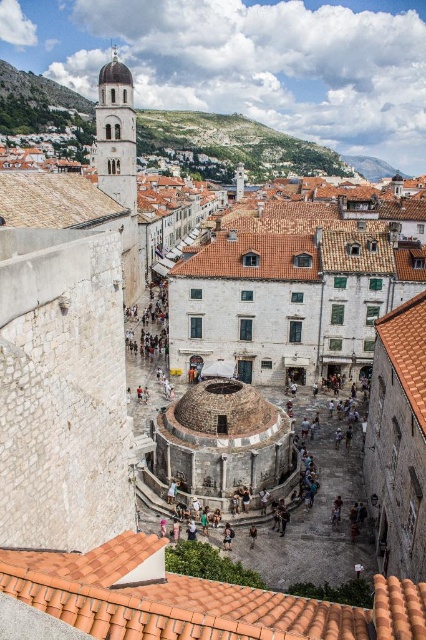
Looking at this image, can you confirm if dark brown leather backpack at center is shorter than brown leather jacket at center?

No.

From the picture: Is dark brown leather backpack at center positioned at the back of brown leather jacket at center?

No.

At what (x,y) coordinates should I click in order to perform the action: click on dark brown leather backpack at center. Please return your answer as a coordinate pair (x, y). Looking at the image, I should click on (227, 536).

What do you see at coordinates (192, 598) in the screenshot?
I see `brown tile roof at lower center` at bounding box center [192, 598].

Between brown tile roof at lower center and smooth stone tower at center, which one has more height?

With more height is smooth stone tower at center.

Does point (28, 579) come behind point (121, 118)?

No, it is in front of (121, 118).

What are the coordinates of `brown tile roof at lower center` in the screenshot? It's located at (192, 598).

Can you confirm if smooth stone tower at center is positioned to the left of terracotta tiled roof at upper left?

Yes, smooth stone tower at center is to the left of terracotta tiled roof at upper left.

Is smooth stone tower at center above terracotta tiled roof at upper left?

Yes.

Measure the distance between point (120, 196) and camera.

They are 85.71 meters apart.

Where is `smooth stone tower at center`? smooth stone tower at center is located at coordinates (118, 163).